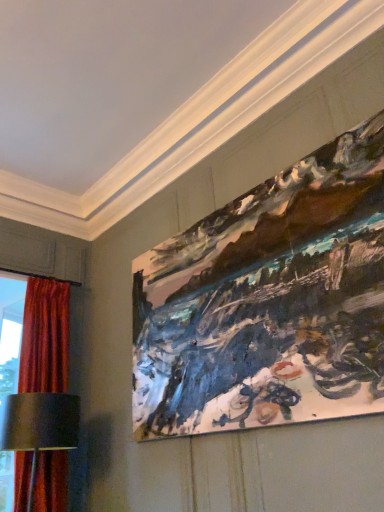
Question: Is velvet red curtain at left to the left or to the right of painted canvas at upper right in the image?

Choices:
 (A) right
 (B) left

Answer: (B)

Question: From the image's perspective, is velvet red curtain at left positioned above or below painted canvas at upper right?

Choices:
 (A) below
 (B) above

Answer: (A)

Question: Based on their relative distances, which object is farther from the painted canvas at upper right?

Choices:
 (A) metallic silver table lamp at lower left
 (B) velvet red curtain at left

Answer: (B)

Question: Which of these objects is positioned closest to the metallic silver table lamp at lower left?

Choices:
 (A) velvet red curtain at left
 (B) painted canvas at upper right

Answer: (A)